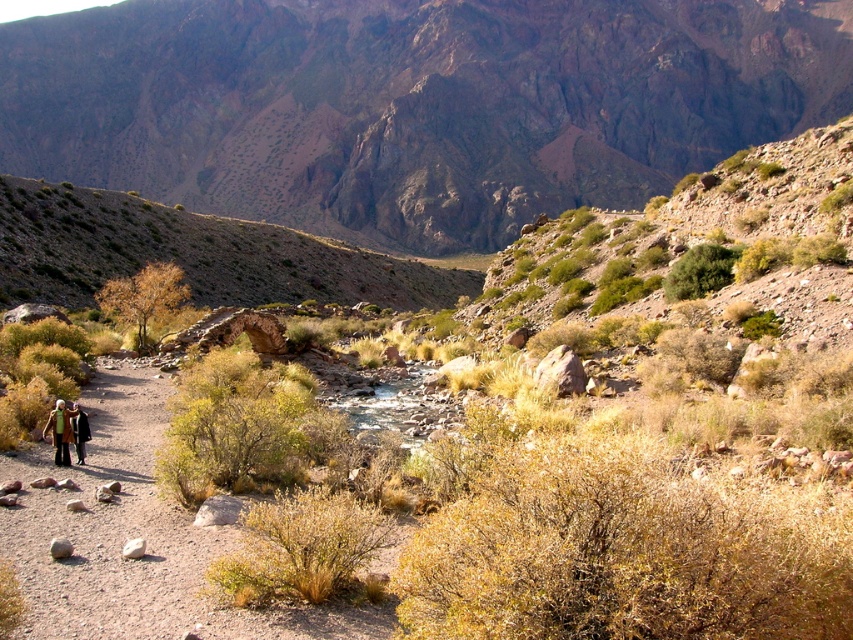
Question: Which of the following is the closest to the observer?

Choices:
 (A) (62, 460)
 (B) (630, 205)

Answer: (A)

Question: Does rugged rock mountain at upper center appear on the right side of camouflage fabric jacket at lower left?

Choices:
 (A) yes
 (B) no

Answer: (A)

Question: Can you confirm if rugged rock mountain at upper center is wider than golden dry bush at center?

Choices:
 (A) no
 (B) yes

Answer: (B)

Question: Estimate the real-world distances between objects in this image. Which object is closer to the camouflage fabric jacket at lower left?

Choices:
 (A) rugged rock mountain at upper center
 (B) golden dry bush at center

Answer: (B)

Question: Which of the following is the closest to the observer?

Choices:
 (A) camouflage fabric jacket at lower left
 (B) golden dry bush at center

Answer: (A)

Question: Is rugged rock mountain at upper center below golden dry bush at center?

Choices:
 (A) yes
 (B) no

Answer: (B)